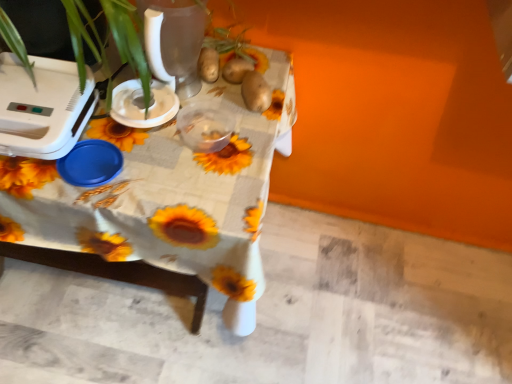
Identify the location of unoccupied space behind brown matte potato at center, acting as the 1th potato starting from the right. (253, 54).